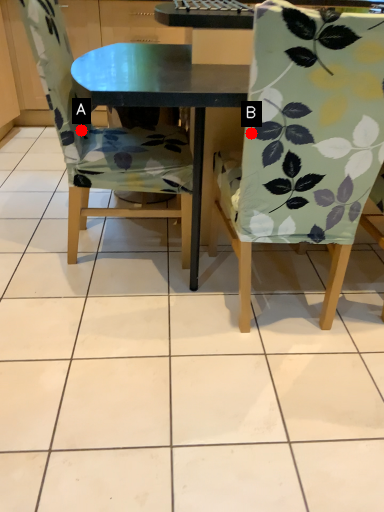
Question: Two points are circled on the image, labeled by A and B beside each circle. Which point is closer to the camera taking this photo?

Choices:
 (A) A is closer
 (B) B is closer

Answer: (B)